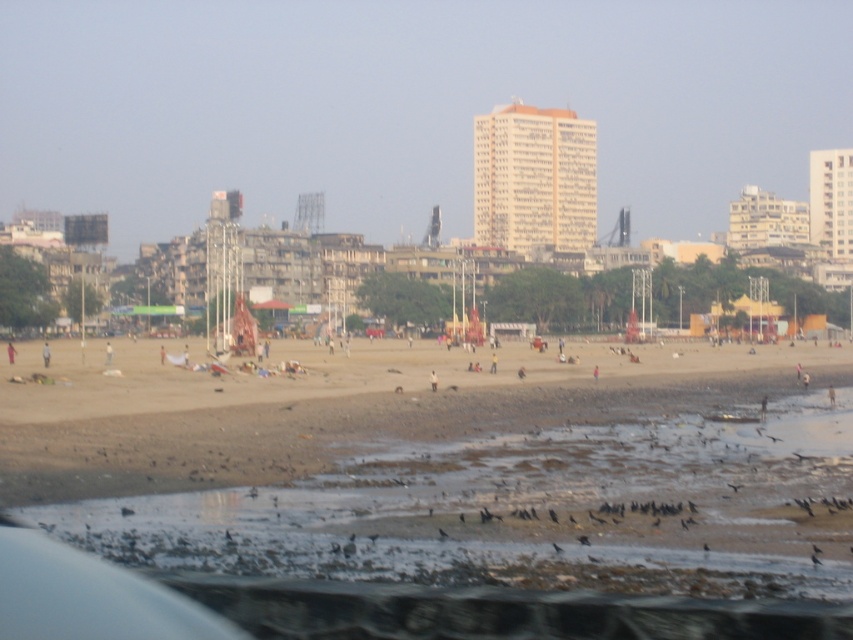
You are standing on the beach and want to avoid stepping on the brown mudflat at lower center. Where should you walk to stay on dry sand?

You should walk away from the point at coordinates (531, 509) where the brown mudflat at lower center is located to stay on dry sand.

You are a bird flying over the beach scene. You see the brown mudflat at lower center and the brown sand at lower center. If you want to land on the closest one to your current position, which one should you choose?

The brown mudflat at lower center is 63.13 feet away from brown sand at lower center. Without knowing your exact position, it is impossible to determine which is closer.